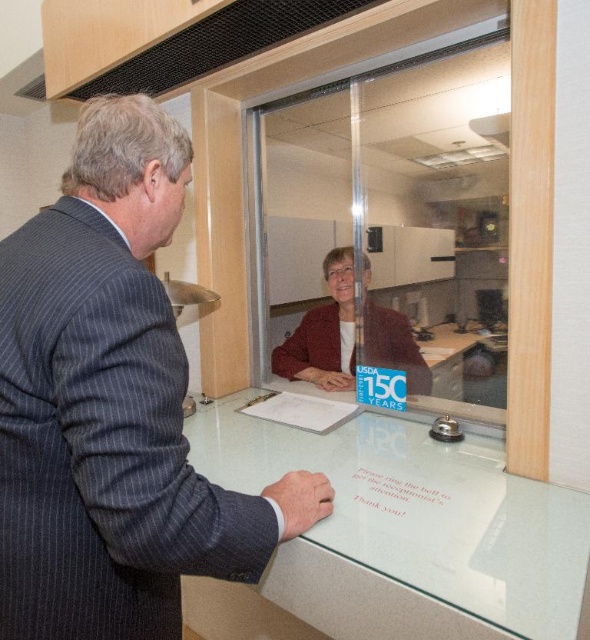
Question: Does dark gray pinstripe suit at center come behind clear glass table at center?

Choices:
 (A) yes
 (B) no

Answer: (B)

Question: Is dark gray pinstripe suit at center positioned behind matte black suit at center?

Choices:
 (A) no
 (B) yes

Answer: (A)

Question: Among these objects, which one is nearest to the camera?

Choices:
 (A) clear glass table at center
 (B) dark gray pinstripe suit at center

Answer: (B)

Question: Which of the following is the farthest from the observer?

Choices:
 (A) dark gray pinstripe suit at center
 (B) matte black suit at center
 (C) clear glass table at center

Answer: (B)

Question: Where is dark gray pinstripe suit at center located in relation to matte black suit at center in the image?

Choices:
 (A) below
 (B) above

Answer: (A)

Question: Which point appears farthest from the camera in this image?

Choices:
 (A) (303, 324)
 (B) (68, 460)
 (C) (404, 608)

Answer: (A)